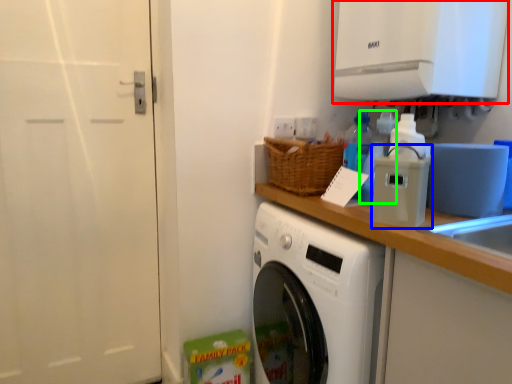
Question: Considering the real-world distances, which object is closest to exhaust hood (highlighted by a red box)? appliance (highlighted by a blue box) or bottle (highlighted by a green box).

Choices:
 (A) appliance
 (B) bottle

Answer: (B)